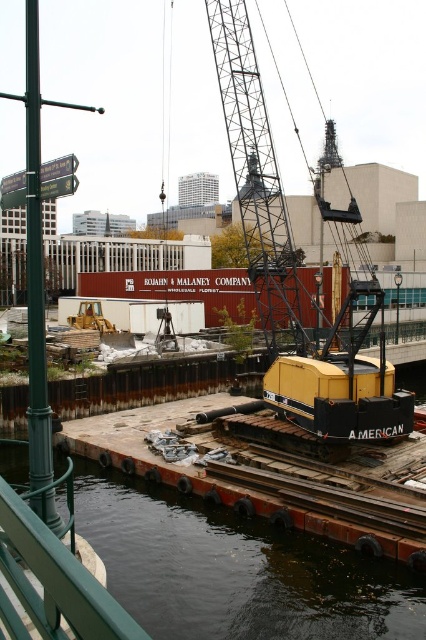
You are standing at the construction site and want to move from the point at coordinates point (212, 564) to point (293, 257). Which direction should you move to reach your destination?

To move from point (212, 564) to point (293, 257), you should move backward since point (212, 564) is in front of point (293, 257).

Based on the photo, you are a safety inspector assessing the construction site. You notice the dark water at lower left and the yellow metallic crane at center. Which object is closer to the ground level?

The dark water at lower left is shorter than the yellow metallic crane at center, so the dark water at lower left is closer to the ground level.

In the scene shown: You are a safety inspector assessing the construction site. You notice the dark water at lower left and the yellow metallic crane at center. Which object is located below the other?

The dark water at lower left is positioned under the yellow metallic crane at center, so the dark water at lower left is below the yellow metallic crane at center.